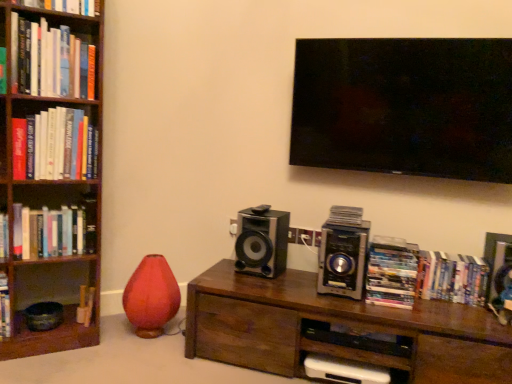
Where is `vacant area to the right of hardcover books at center right, which is the 3th book from bottom to top`? vacant area to the right of hardcover books at center right, which is the 3th book from bottom to top is located at coordinates (440, 304).